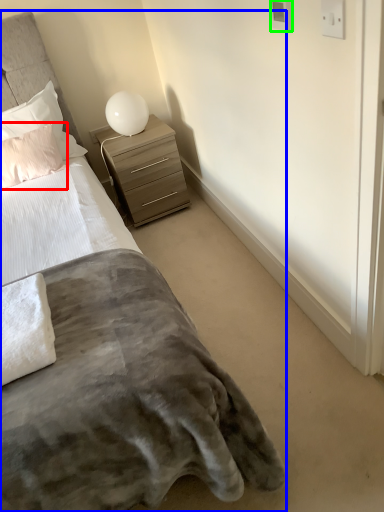
Question: Considering the real-world distances, which object is closest to pillow (highlighted by a red box)? bed (highlighted by a blue box) or electric outlet (highlighted by a green box).

Choices:
 (A) bed
 (B) electric outlet

Answer: (A)